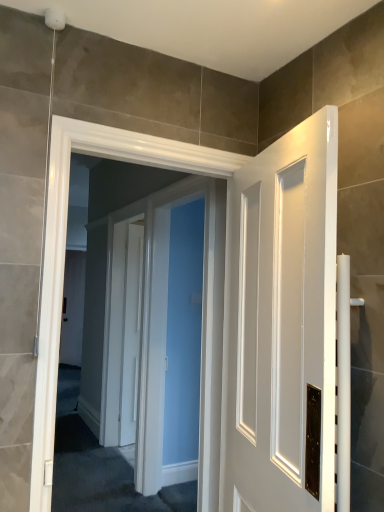
The width and height of the screenshot is (384, 512). Describe the element at coordinates (131, 333) in the screenshot. I see `white glossy door at center` at that location.

Locate an element on the screen. white glossy door at center is located at coordinates (131, 333).

In order to face white glossy door at center, should I rotate leftwards or rightwards?

To face it directly, rotate left by 8.500 degrees.

Image resolution: width=384 pixels, height=512 pixels. What do you see at coordinates (162, 328) in the screenshot?
I see `white glossy door at center` at bounding box center [162, 328].

Locate an element on the screen. The height and width of the screenshot is (512, 384). white glossy door at center is located at coordinates (162, 328).

You are a GUI agent. You are given a task and a screenshot of the screen. Output one action in this format:
    pyautogui.click(x=<x>, y=<y>)
    Task: Click on the white glossy door at center
    The height and width of the screenshot is (512, 384).
    Given the screenshot: What is the action you would take?
    pyautogui.click(x=131, y=333)

Based on their positions, is white glossy door at center located to the left or right of white glossy door at center?

In the image, white glossy door at center appears on the right side of white glossy door at center.

Which is behind, white glossy door at center or white glossy door at center?

white glossy door at center.

Which is further, (139, 237) or (140, 402)?

The point (139, 237) is more distant.

From the image's perspective, between white glossy door at center and white glossy door at center, which one is located above?

white glossy door at center.

From a real-world perspective, which object rests below the other?

In real-world perspective, white glossy door at center is lower.

Is white glossy door at center wider than white glossy door at center?

No, white glossy door at center is not wider than white glossy door at center.

Consider the image. Which of these two, white glossy door at center or white glossy door at center, stands taller?

white glossy door at center.

In the scene shown: Is white glossy door at center bigger than white glossy door at center?

Incorrect, white glossy door at center is not larger than white glossy door at center.

Is white glossy door at center not inside white glossy door at center?

white glossy door at center lies outside white glossy door at center's area.

Would you say white glossy door at center is a long distance from white glossy door at center?

No, there isn't a large distance between white glossy door at center and white glossy door at center.

Is white glossy door at center at the back of white glossy door at center?

No.

How different are the orientations of white glossy door at center and white glossy door at center in degrees?

The angular difference between white glossy door at center and white glossy door at center is 85.6 degrees.

How much distance is there between white glossy door at center and white glossy door at center?

They are 14.09 inches apart.

Where is `screen door in front of the white glossy door at center`? Image resolution: width=384 pixels, height=512 pixels. screen door in front of the white glossy door at center is located at coordinates (162, 328).

Looking at this image, is white glossy door at center to the left or to the right of white glossy door at center in the image?

white glossy door at center is positioned on white glossy door at center's left side.

Does white glossy door at center lie behind white glossy door at center?

No, it is not.

Is point (159, 290) positioned behind point (134, 231)?

That is False.

From the image's perspective, is white glossy door at center above or below white glossy door at center?

white glossy door at center is situated higher than white glossy door at center in the image.

From a real-world perspective, is white glossy door at center physically located above or below white glossy door at center?

white glossy door at center is situated higher than white glossy door at center in the real world.

Considering the relative sizes of white glossy door at center and white glossy door at center in the image provided, is white glossy door at center wider than white glossy door at center?

Correct, the width of white glossy door at center exceeds that of white glossy door at center.

Is white glossy door at center shorter than white glossy door at center?

Yes.

Considering the sizes of objects white glossy door at center and white glossy door at center in the image provided, who is smaller, white glossy door at center or white glossy door at center?

white glossy door at center is smaller.

Is white glossy door at center inside white glossy door at center?

No, white glossy door at center is located outside of white glossy door at center.

Is white glossy door at center not close to white glossy door at center?

No.

Could you tell me if white glossy door at center is facing white glossy door at center?

Yes, white glossy door at center faces towards white glossy door at center.

How many degrees apart are the facing directions of white glossy door at center and white glossy door at center?

85.6 degrees.

Identify the location of door that is behind the white glossy door at center. (131, 333).

The image size is (384, 512). I want to click on screen door lying in front of the white glossy door at center, so click(162, 328).

Where is `door below the white glossy door at center (from the image's perspective)`? The width and height of the screenshot is (384, 512). door below the white glossy door at center (from the image's perspective) is located at coordinates (131, 333).